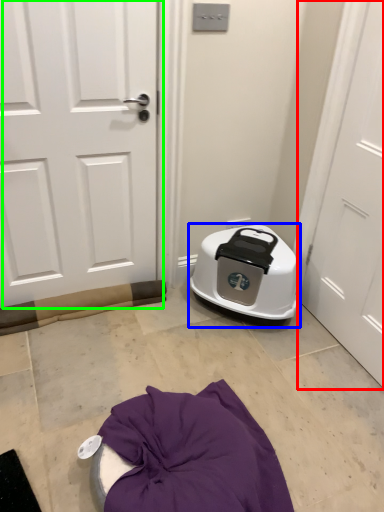
Question: Based on their relative distances, which object is farther from door (highlighted by a red box)? Choose from appliance (highlighted by a blue box) and door (highlighted by a green box).

Choices:
 (A) appliance
 (B) door

Answer: (B)